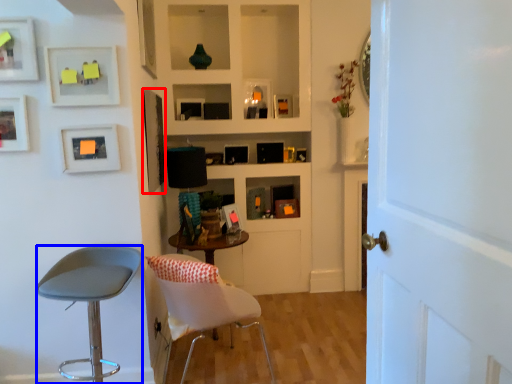
Question: Which of the following is the farthest to the observer, picture frame (highlighted by a red box) or chair (highlighted by a blue box)?

Choices:
 (A) picture frame
 (B) chair

Answer: (A)